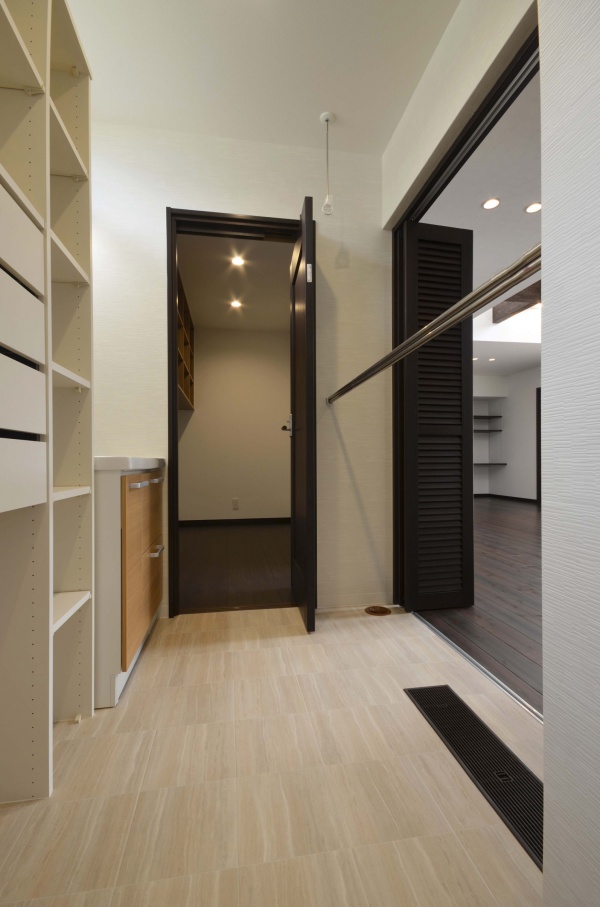
At what (x,y) coordinates should I click in order to perform the action: click on dark wood floor. Please return your answer as a coordinate pair (x, y). Looking at the image, I should click on (493, 642), (236, 564).